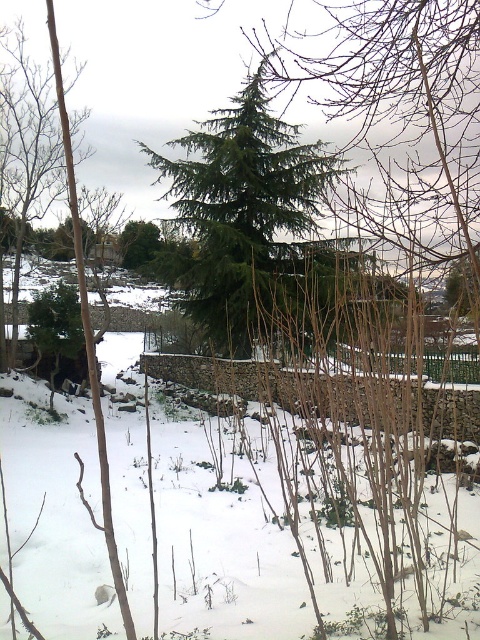
You are an outdoor maintenance worker who needs to trim the green matte tree at center so that it doesn not obstruct the stone wall at center. Based on the scene description, can you determine if the tree is currently close enough to the wall to require trimming?

Result: The stone wall at center and green matte tree at center are 7.63 meters apart. Since the distance between them is over 7 meters, the tree is not close enough to the wall to require trimming to prevent obstruction.

You are standing in the winter scene and want to walk from the point closer to you to the point further away. Which path would you take between the two points, point(x=194, y=164) and point(x=308, y=412)?

The path from point(x=194, y=164) to point(x=308, y=412) requires moving away from the viewer since point(x=194, y=164) is closer to you than point(x=308, y=412).